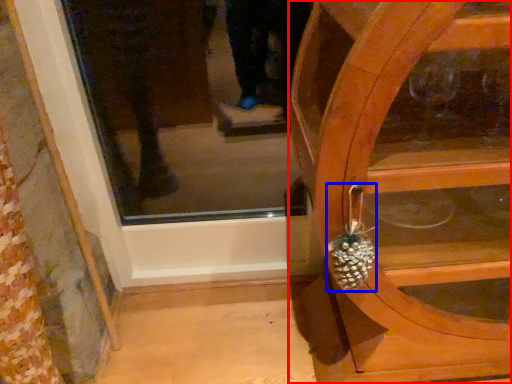
Question: Which object appears closest to the camera in this image, furniture (highlighted by a red box) or pineapple (highlighted by a blue box)?

Choices:
 (A) furniture
 (B) pineapple

Answer: (A)